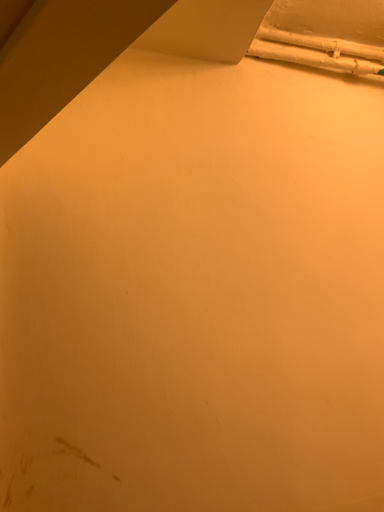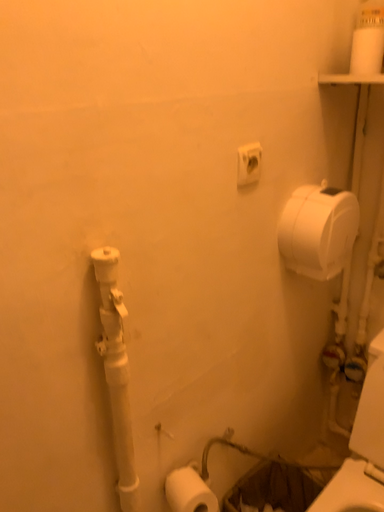
Question: Which way did the camera rotate in the video?

Choices:
 (A) rotated left
 (B) rotated right

Answer: (B)